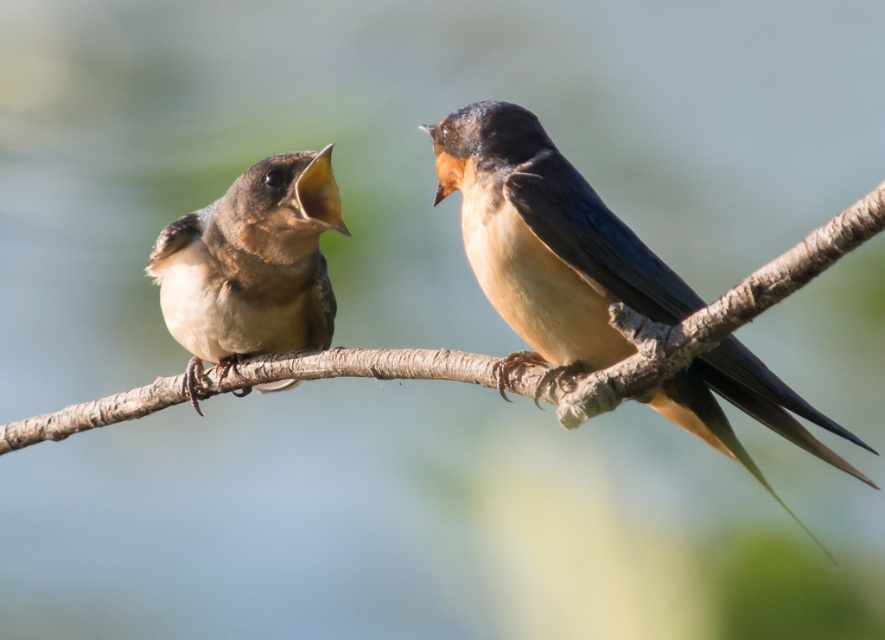
In the scene shown: Is brown glossy swallow at right below brown textured branch at center?

No.

How distant is brown glossy swallow at right from brown textured branch at center?

brown glossy swallow at right and brown textured branch at center are 10.14 inches apart.

Locate an element on the screen. Image resolution: width=885 pixels, height=640 pixels. brown glossy swallow at right is located at coordinates (545, 243).

In order to click on brown glossy swallow at right in this screenshot , I will do coord(545,243).

Does brown glossy swallow at right appear over brown matte bird at left?

Yes.

Which is in front, point (676, 312) or point (237, 312)?

Point (676, 312) is in front.

This screenshot has width=885, height=640. Find the location of `brown glossy swallow at right`. brown glossy swallow at right is located at coordinates (545, 243).

Is brown matte bird at left wider than brown textured branch at center?

No.

Which is behind, point (195, 333) or point (689, 320)?

The point (195, 333) is more distant.

Where is `brown matte bird at left`? brown matte bird at left is located at coordinates (251, 266).